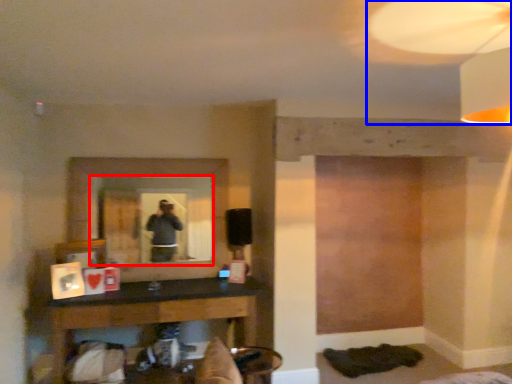
Question: Which of the following is the farthest to the observer, mirror (highlighted by a red box) or mechanical fan (highlighted by a blue box)?

Choices:
 (A) mirror
 (B) mechanical fan

Answer: (A)